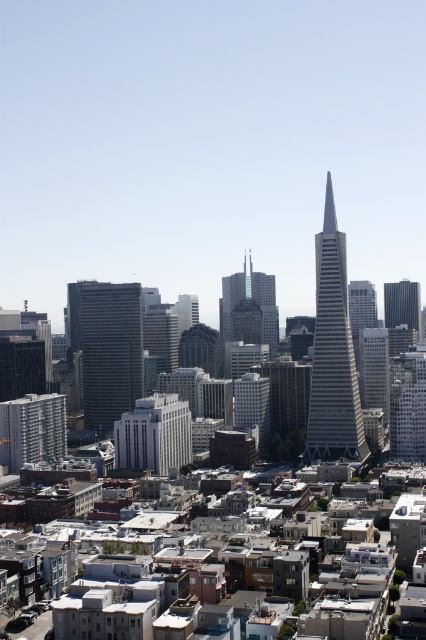
Does white concrete building at lower left appear under black glass skyscraper at right?

Yes.

Which is more to the left, white concrete building at lower left or black glass skyscraper at right?

From the viewer's perspective, white concrete building at lower left appears more on the left side.

Who is more distant from viewer, (2, 456) or (402, 316)?

Positioned behind is point (2, 456).

The height and width of the screenshot is (640, 426). I want to click on white concrete building at lower left, so click(31, 429).

Which of these two, glassy silver skyscraper at center or black glass skyscraper at right, stands taller?

Standing taller between the two is glassy silver skyscraper at center.

Between point (339, 413) and point (389, 314), which one is positioned behind?

Point (389, 314)

I want to click on glassy silver skyscraper at center, so click(x=333, y=353).

Does white smooth building at center appear over white concrete building at lower left?

Actually, white smooth building at center is below white concrete building at lower left.

This screenshot has height=640, width=426. Describe the element at coordinates (154, 435) in the screenshot. I see `white smooth building at center` at that location.

Identify the location of white smooth building at center. The width and height of the screenshot is (426, 640). (154, 435).

This screenshot has height=640, width=426. In order to click on white smooth building at center in this screenshot , I will do `click(154, 435)`.